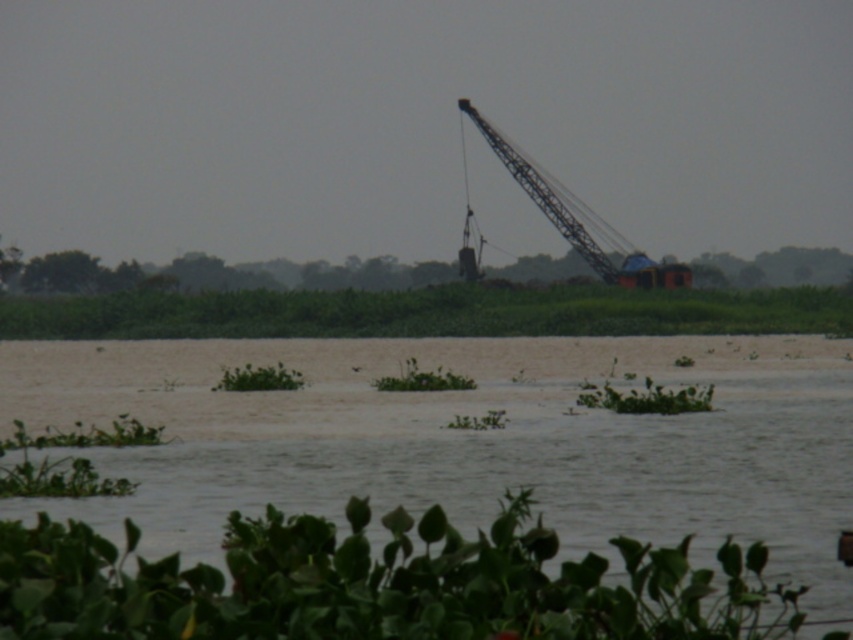
Who is higher up, green leafy plant at lower center or metallic gray crane at upper center?

metallic gray crane at upper center is higher up.

Is point (206, 580) positioned after point (624, 276)?

No.

This screenshot has height=640, width=853. Describe the element at coordinates (375, 584) in the screenshot. I see `green leafy plant at lower center` at that location.

Identify the location of green leafy plant at lower center. (375, 584).

Is green leafy plants at center wider than metallic gray crane at upper center?

Yes.

Can you confirm if green leafy plants at center is positioned to the left of metallic gray crane at upper center?

Yes, green leafy plants at center is to the left of metallic gray crane at upper center.

Where is `green leafy plants at center`? This screenshot has width=853, height=640. green leafy plants at center is located at coordinates (428, 312).

I want to click on green leafy plants at center, so click(x=428, y=312).

Is green leafy plant at lower center below green leafy plants at center?

Correct, green leafy plant at lower center is located below green leafy plants at center.

Measure the distance from green leafy plant at lower center to green leafy plants at center.

green leafy plant at lower center is 66.23 meters from green leafy plants at center.

Which is behind, point (561, 605) or point (728, 301)?

The point (728, 301) is behind.

Identify the location of green leafy plant at lower center. The image size is (853, 640). click(375, 584).